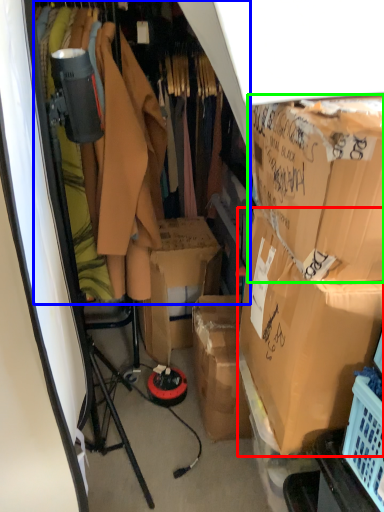
Question: Estimate the real-world distances between objects in this image. Which object is farther from box (highlighted by a red box), closet (highlighted by a blue box) or box (highlighted by a green box)?

Choices:
 (A) closet
 (B) box

Answer: (A)